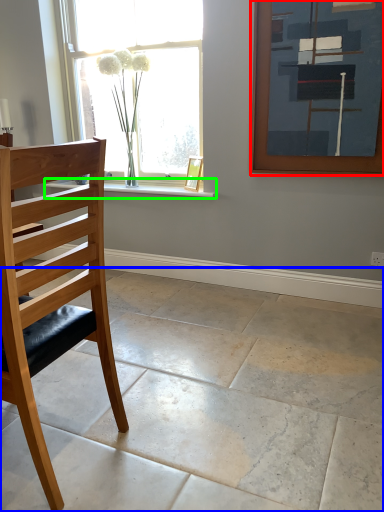
Question: Which object is positioned farthest from picture frame (highlighted by a red box)? Select from concrete (highlighted by a blue box) and window sill (highlighted by a green box).

Choices:
 (A) concrete
 (B) window sill

Answer: (A)